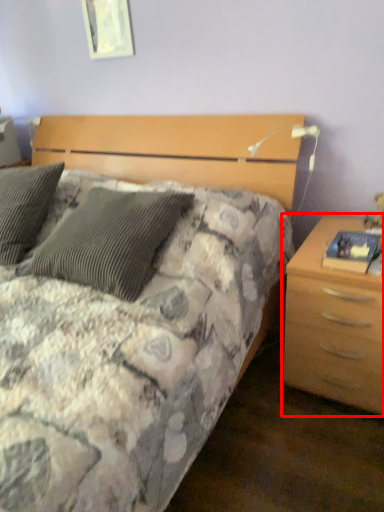
Question: Where is nightstand (annotated by the red box) located in relation to picture frame in the image?

Choices:
 (A) left
 (B) right

Answer: (B)